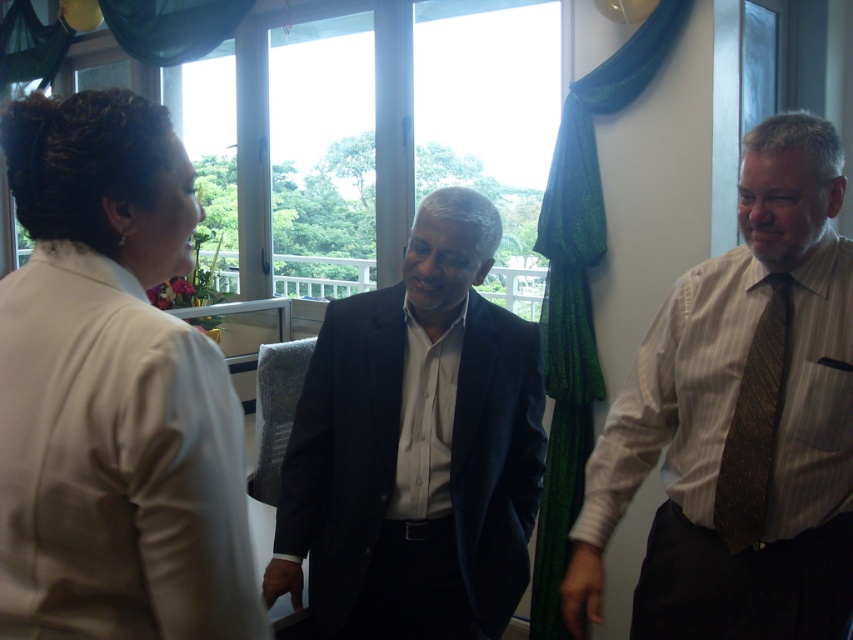
Question: Can you confirm if white satin blouse at upper left is positioned above dark blue suit at center?

Choices:
 (A) yes
 (B) no

Answer: (A)

Question: Which of these objects is positioned closest to the white satin blouse at upper left?

Choices:
 (A) brown textured tie at right
 (B) green shimmering curtain at center
 (C) dark blue suit at center

Answer: (C)

Question: Which point is closer to the camera taking this photo?

Choices:
 (A) pos(480,269)
 (B) pos(590,444)
 (C) pos(761,476)
 (D) pos(160,625)

Answer: (D)

Question: Is white satin blouse at upper left wider than brown textured tie at right?

Choices:
 (A) yes
 (B) no

Answer: (A)

Question: Can you confirm if striped cotton shirt at right is wider than brown textured tie at right?

Choices:
 (A) no
 (B) yes

Answer: (B)

Question: Which of the following is the farthest from the observer?

Choices:
 (A) brown textured tie at right
 (B) white satin blouse at upper left

Answer: (A)